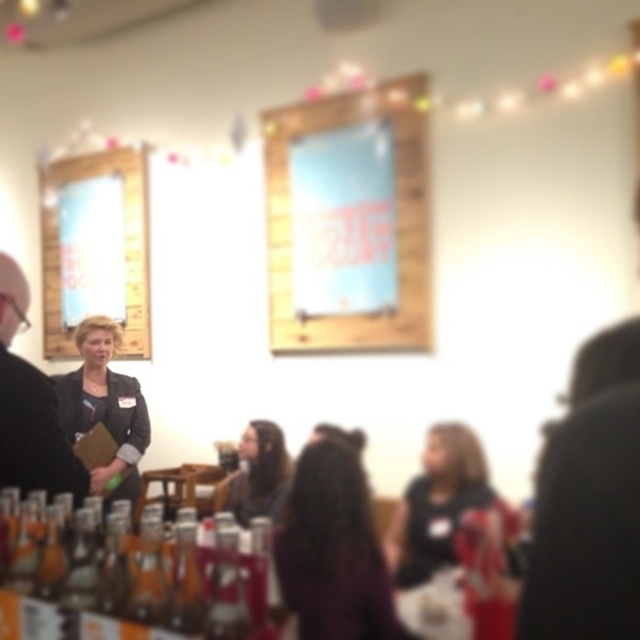
Question: Estimate the real-world distances between objects in this image. Which object is farther from the translucent glass bottles at lower left?

Choices:
 (A) dark brown hair at center
 (B) matte black jacket at left

Answer: (B)

Question: Which object is closer to the camera taking this photo?

Choices:
 (A) long brown hair at center
 (B) wooden frame at upper left

Answer: (A)

Question: Is matte black shirt at center above matte black blazer at center?

Choices:
 (A) no
 (B) yes

Answer: (A)

Question: Does wooden frame at center appear under matte black blazer at center?

Choices:
 (A) no
 (B) yes

Answer: (A)

Question: Is matte black shirt at center to the left of long brown hair at center from the viewer's perspective?

Choices:
 (A) yes
 (B) no

Answer: (B)

Question: Based on their relative distances, which object is farther from the wooden frame at center?

Choices:
 (A) matte black jacket at left
 (B) long brown hair at center

Answer: (A)